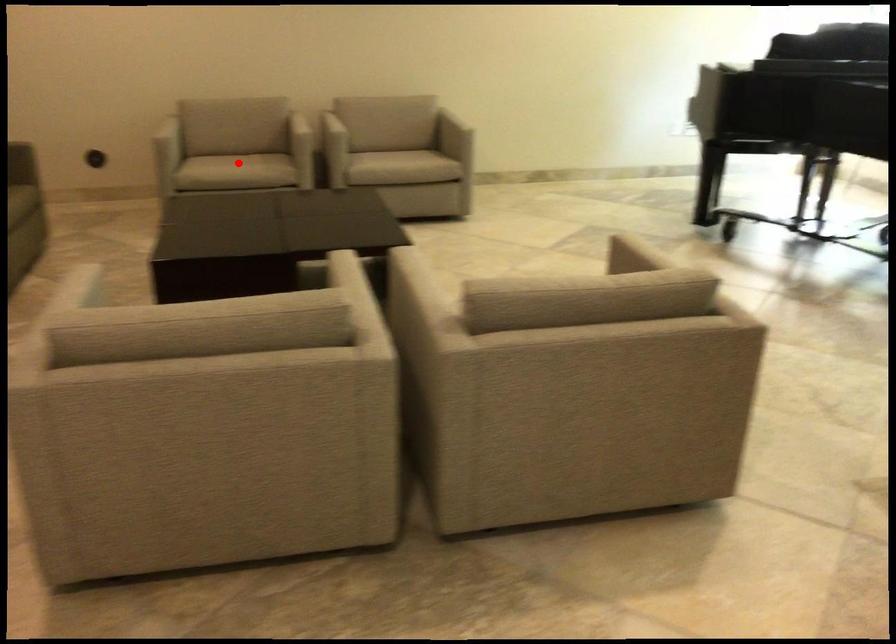
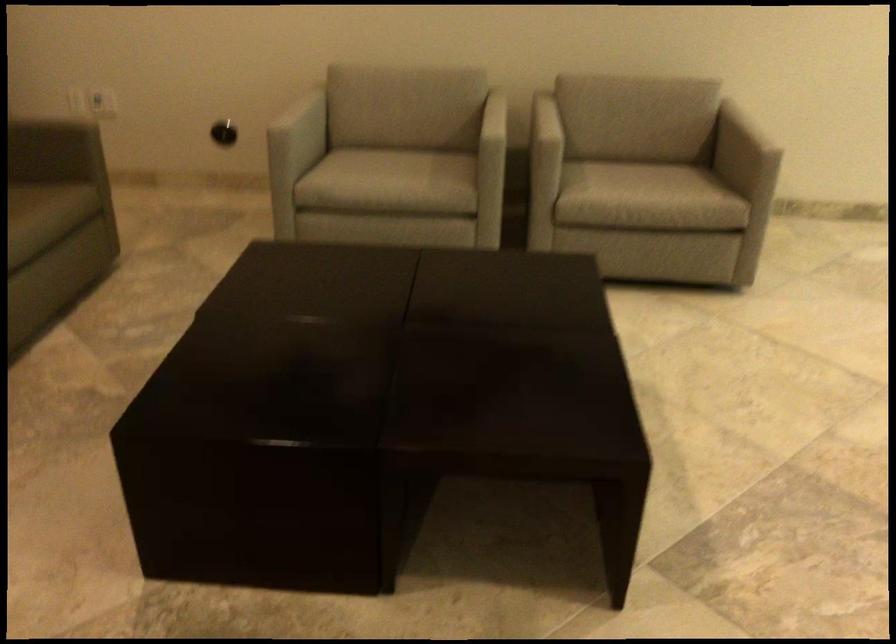
Find the pixel in the second image that matches the highlighted location in the first image.

(390, 176)